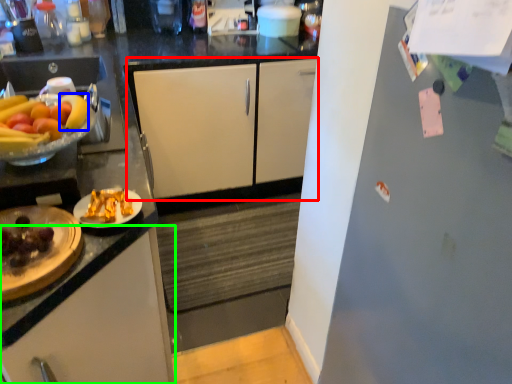
Question: Which is farther away from cabinetry (highlighted by a red box)? banana (highlighted by a blue box) or cabinetry (highlighted by a green box)?

Choices:
 (A) banana
 (B) cabinetry

Answer: (B)